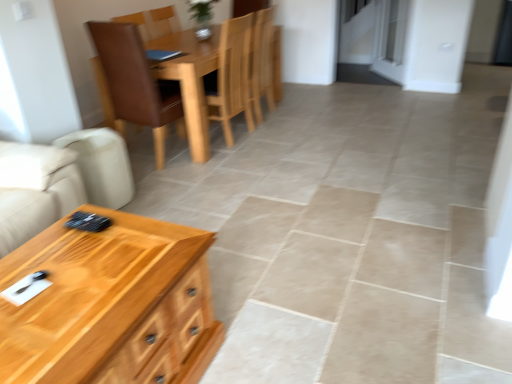
Question: Is brown leather chair at upper center, marked as the first chair in a left-to-right arrangement, smaller than wooden chair at center, positioned as the first chair in right-to-left order?

Choices:
 (A) yes
 (B) no

Answer: (B)

Question: Is brown leather chair at upper center, which is counted as the 2th chair, starting from the right, facing towards wooden chair at center, the second chair in the left-to-right sequence?

Choices:
 (A) yes
 (B) no

Answer: (A)

Question: Considering the relative sizes of brown leather chair at upper center, marked as the first chair in a left-to-right arrangement, and wooden chair at center, the second chair in the left-to-right sequence, in the image provided, is brown leather chair at upper center, marked as the first chair in a left-to-right arrangement, shorter than wooden chair at center, the second chair in the left-to-right sequence,?

Choices:
 (A) yes
 (B) no

Answer: (B)

Question: Is brown leather chair at upper center, marked as the first chair in a left-to-right arrangement, bigger than wooden chair at center, positioned as the first chair in right-to-left order?

Choices:
 (A) yes
 (B) no

Answer: (A)

Question: Is brown leather chair at upper center, which is counted as the 2th chair, starting from the right, positioned beyond the bounds of wooden chair at center, the second chair in the left-to-right sequence?

Choices:
 (A) yes
 (B) no

Answer: (A)

Question: In terms of height, does brown leather chair at upper center, which is counted as the 2th chair, starting from the right, look taller or shorter compared to wooden coffee table at lower left?

Choices:
 (A) short
 (B) tall

Answer: (B)

Question: In the image, is brown leather chair at upper center, which is counted as the 2th chair, starting from the right, on the left side or the right side of wooden coffee table at lower left?

Choices:
 (A) left
 (B) right

Answer: (A)

Question: Does point (181, 105) appear closer or farther from the camera than point (62, 266)?

Choices:
 (A) farther
 (B) closer

Answer: (A)

Question: Is brown leather chair at upper center, marked as the first chair in a left-to-right arrangement, in front of or behind wooden coffee table at lower left in the image?

Choices:
 (A) behind
 (B) front

Answer: (A)

Question: From the image's perspective, is wooden chair at center, positioned as the first chair in right-to-left order, above or below brown leather chair at upper center, marked as the first chair in a left-to-right arrangement?

Choices:
 (A) above
 (B) below

Answer: (A)

Question: From a real-world perspective, is wooden chair at center, the second chair in the left-to-right sequence, above or below brown leather chair at upper center, which is counted as the 2th chair, starting from the right?

Choices:
 (A) below
 (B) above

Answer: (A)

Question: Considering their positions, is wooden chair at center, the second chair in the left-to-right sequence, located in front of or behind brown leather chair at upper center, which is counted as the 2th chair, starting from the right?

Choices:
 (A) front
 (B) behind

Answer: (B)

Question: Is wooden chair at center, positioned as the first chair in right-to-left order, taller or shorter than brown leather chair at upper center, which is counted as the 2th chair, starting from the right?

Choices:
 (A) short
 (B) tall

Answer: (A)

Question: From a real-world perspective, relative to wooden coffee table at lower left, is wooden chair at center, positioned as the first chair in right-to-left order, vertically above or below?

Choices:
 (A) above
 (B) below

Answer: (A)

Question: Is wooden chair at center, the second chair in the left-to-right sequence, taller or shorter than wooden coffee table at lower left?

Choices:
 (A) tall
 (B) short

Answer: (A)